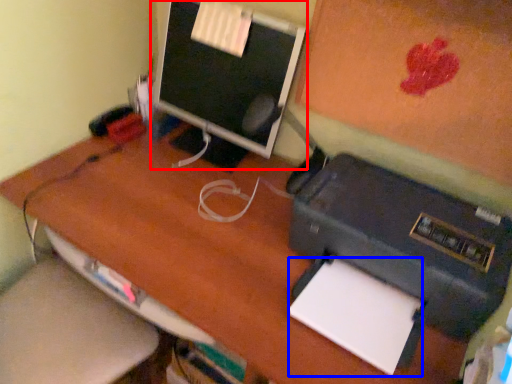
Question: Which of the following is the closest to the observer, computer monitor (highlighted by a red box) or notepad (highlighted by a blue box)?

Choices:
 (A) computer monitor
 (B) notepad

Answer: (B)